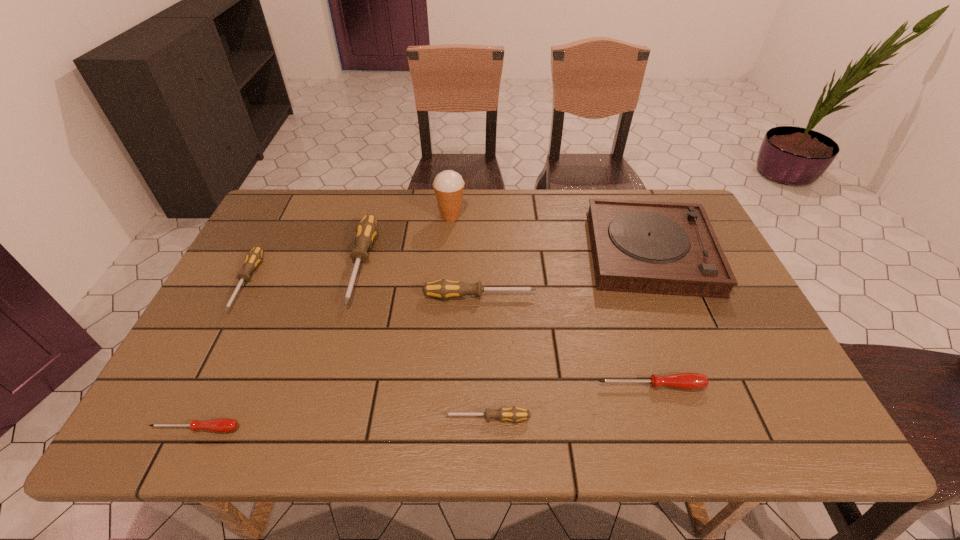
Identify the location of vacant space at the right edge. (725, 338).

I want to click on vacant space at the near right corner of the desktop, so click(x=796, y=440).

Identify the location of free space between the second tallest screwdriver and the leftmost gray screwdriver. The width and height of the screenshot is (960, 540). (363, 289).

Where is `free space between the bigger red screwdriver and the third object from left to right`? free space between the bigger red screwdriver and the third object from left to right is located at coordinates (506, 325).

Where is `free space between the fifth shortest object and the rightmost screwdriver`? free space between the fifth shortest object and the rightmost screwdriver is located at coordinates (565, 341).

Find the location of a particular element. This screenshot has width=960, height=540. blank region between the second tallest screwdriver and the tallest object is located at coordinates (466, 256).

At what (x,y) coordinates should I click in order to perform the action: click on vacant space in between the second tallest screwdriver and the phonograph record. Please return your answer as a coordinate pair (x, y). This screenshot has width=960, height=540. Looking at the image, I should click on (565, 274).

At what (x,y) coordinates should I click in order to perform the action: click on vacant point located between the third object from left to right and the phonograph record. Please return your answer as a coordinate pair (x, y). The image size is (960, 540). Looking at the image, I should click on (506, 258).

Where is `vacant area that lies between the phonograph record and the rightmost screwdriver`? vacant area that lies between the phonograph record and the rightmost screwdriver is located at coordinates (651, 319).

This screenshot has height=540, width=960. I want to click on vacant space that's between the sixth object from right to left and the phonograph record, so click(x=506, y=258).